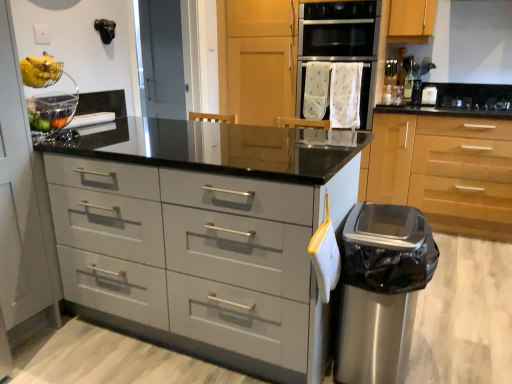
Question: Is black glass gas stove at upper right with matte gray drawers at center?

Choices:
 (A) no
 (B) yes

Answer: (A)

Question: Could matte gray drawers at center be considered to be inside black glass gas stove at upper right?

Choices:
 (A) no
 (B) yes

Answer: (A)

Question: Can you confirm if black glass gas stove at upper right is taller than matte gray drawers at center?

Choices:
 (A) no
 (B) yes

Answer: (A)

Question: Is black glass gas stove at upper right facing towards matte gray drawers at center?

Choices:
 (A) yes
 (B) no

Answer: (B)

Question: Can you confirm if black glass gas stove at upper right is positioned to the left of matte gray drawers at center?

Choices:
 (A) no
 (B) yes

Answer: (A)

Question: From the image's perspective, is yellow matte bananas at upper left located above or below stainless steel oven at upper center?

Choices:
 (A) below
 (B) above

Answer: (A)

Question: In the image, is yellow matte bananas at upper left on the left side or the right side of stainless steel oven at upper center?

Choices:
 (A) left
 (B) right

Answer: (A)

Question: Considering the positions of yellow matte bananas at upper left and stainless steel oven at upper center in the image, is yellow matte bananas at upper left taller or shorter than stainless steel oven at upper center?

Choices:
 (A) tall
 (B) short

Answer: (B)

Question: From a real-world perspective, is yellow matte bananas at upper left positioned above or below stainless steel oven at upper center?

Choices:
 (A) below
 (B) above

Answer: (A)

Question: Is satin black oven at upper center bigger or smaller than white fabric oven at center?

Choices:
 (A) big
 (B) small

Answer: (B)

Question: From the image's perspective, relative to white fabric oven at center, is satin black oven at upper center above or below?

Choices:
 (A) above
 (B) below

Answer: (A)

Question: Considering the positions of point (435, 92) and point (356, 34), is point (435, 92) closer or farther from the camera than point (356, 34)?

Choices:
 (A) closer
 (B) farther

Answer: (B)

Question: In the image, is satin black oven at upper center on the left side or the right side of white fabric oven at center?

Choices:
 (A) right
 (B) left

Answer: (A)

Question: Considering the positions of black glass gas stove at upper right and stainless steel trash can at lower right in the image, is black glass gas stove at upper right wider or thinner than stainless steel trash can at lower right?

Choices:
 (A) wide
 (B) thin

Answer: (A)

Question: Would you say black glass gas stove at upper right is inside or outside stainless steel trash can at lower right?

Choices:
 (A) inside
 (B) outside

Answer: (B)